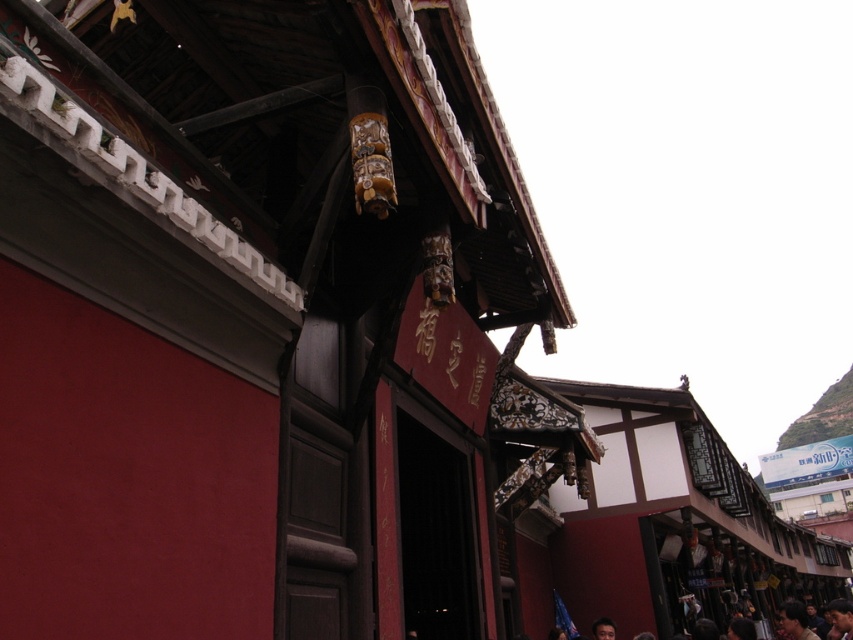
At what (x,y) coordinates should I click in order to perform the action: click on dark brown leather jacket at lower right. Please return your answer as a coordinate pair (x, y). The height and width of the screenshot is (640, 853). Looking at the image, I should click on (795, 620).

How far apart are dark brown leather jacket at lower right and smooth skin face at lower center?

dark brown leather jacket at lower right is 8.26 meters from smooth skin face at lower center.

Locate an element on the screen. The width and height of the screenshot is (853, 640). dark brown leather jacket at lower right is located at coordinates (795, 620).

Locate an element on the screen. Image resolution: width=853 pixels, height=640 pixels. dark brown hair at lower right is located at coordinates (840, 618).

What do you see at coordinates (840, 618) in the screenshot? I see `dark brown hair at lower right` at bounding box center [840, 618].

This screenshot has width=853, height=640. Identify the location of dark brown hair at lower right. (840, 618).

Does point (787, 628) come farther from viewer compared to point (833, 618)?

No, (787, 628) is in front of (833, 618).

Does point (796, 630) come in front of point (839, 627)?

Yes, point (796, 630) is closer to viewer.

This screenshot has width=853, height=640. Find the location of `dark brown leather jacket at lower right`. dark brown leather jacket at lower right is located at coordinates (795, 620).